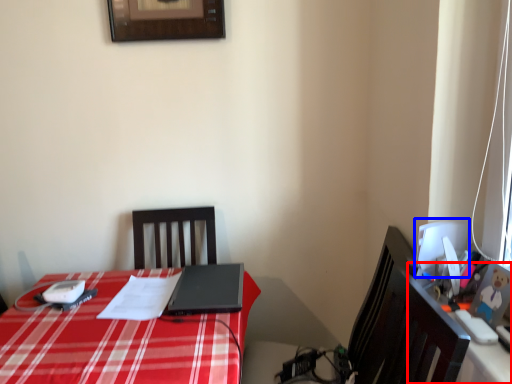
Question: Which of the following is the farthest to the observer, computer desk (highlighted by a red box) or computer monitor (highlighted by a blue box)?

Choices:
 (A) computer desk
 (B) computer monitor

Answer: (B)